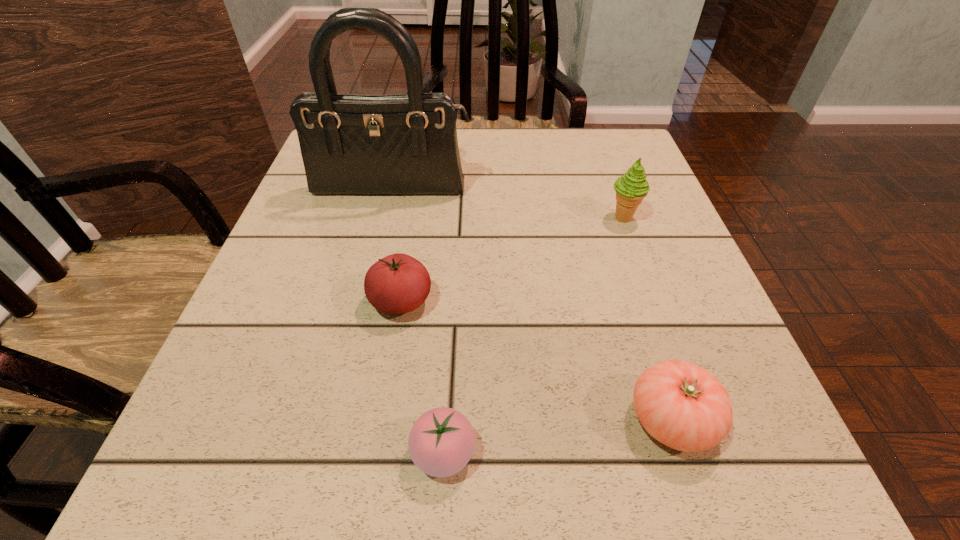
You are a GUI agent. You are given a task and a screenshot of the screen. Output one action in this format:
    pyautogui.click(x=<x>, y=<y>)
    Task: Click on the vacant space located 0.090m on the back of the rightmost tomato
    
    Given the screenshot: What is the action you would take?
    pyautogui.click(x=643, y=331)

Where is `blank area located 0.070m on the left of the shortest object`? This screenshot has width=960, height=540. blank area located 0.070m on the left of the shortest object is located at coordinates (357, 453).

Identify the location of object at the left edge. This screenshot has width=960, height=540. (404, 144).

This screenshot has width=960, height=540. Identify the location of icecream situated at the right edge. (631, 188).

You are a GUI agent. You are given a task and a screenshot of the screen. Output one action in this format:
    pyautogui.click(x=<x>, y=<y>)
    Task: Click on the tomato that is at the right edge
    
    Given the screenshot: What is the action you would take?
    pyautogui.click(x=682, y=405)

Identify the location of object that is positioned at the near right corner. (x=682, y=405).

This screenshot has width=960, height=540. In the image, there is a desktop. What are the coordinates of `vacant space at the far edge` in the screenshot? It's located at (528, 129).

Where is `blank space at the near edge of the desktop`? This screenshot has height=540, width=960. blank space at the near edge of the desktop is located at coordinates (511, 448).

Where is `free space at the left edge of the desktop`? The height and width of the screenshot is (540, 960). free space at the left edge of the desktop is located at coordinates (278, 286).

Where is `vacant space at the right edge of the desktop`? Image resolution: width=960 pixels, height=540 pixels. vacant space at the right edge of the desktop is located at coordinates (652, 181).